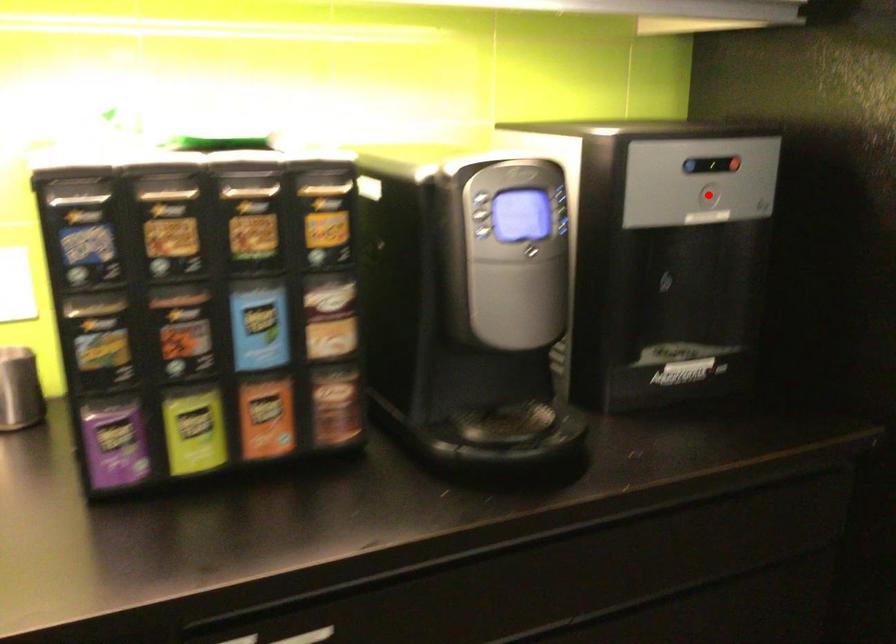
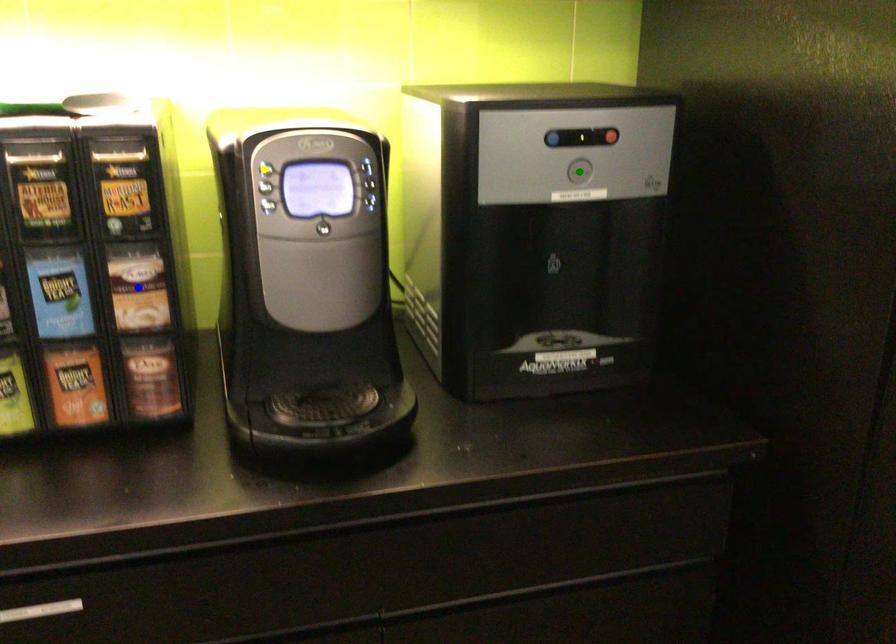
Question: I am providing you with two images of the same scene from different viewpoints. A red point is marked on the first image. You are given multiple points on the second image. Which mark in image 2 goes with the point in image 1?

Choices:
 (A) yellow point
 (B) blue point
 (C) green point

Answer: (C)